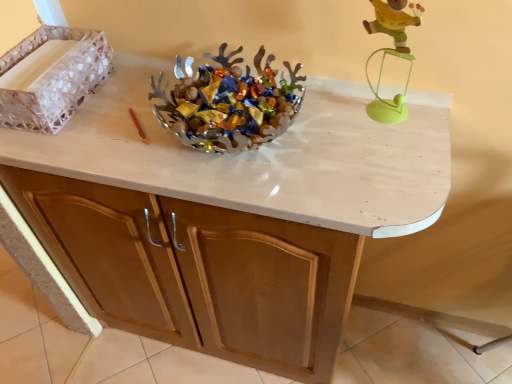
At what (x,y) coordinates should I click in order to perform the action: click on free location in front of wooden figure at upper right. Please return your answer as a coordinate pair (x, y). This screenshot has width=512, height=384. Looking at the image, I should click on (387, 160).